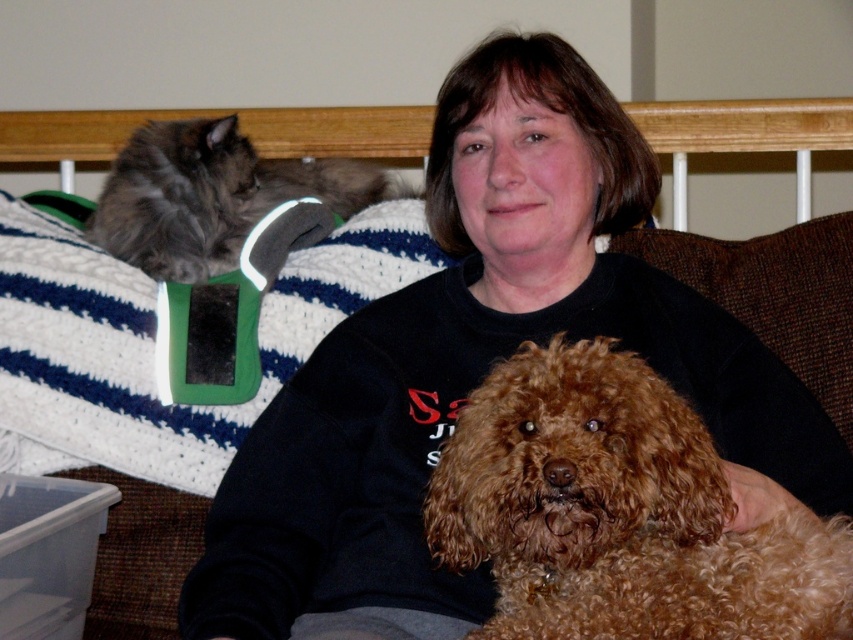
You are a photographer trying to capture a clear shot of the brown curly fur dog at center and the gray fluffy cat at upper left. Since the dog is closer to the camera, will its image appear larger in the photo than the cat?

The brown curly fur dog at center has a lesser width compared to gray fluffy cat at upper left. Even though the dog is closer, its actual width is smaller, so the dog might not appear larger than the cat in the photo depending on the distance difference.

You are a photographer setting up a shot in this scene. You need to position a light source to the left of the gray fluffy cat at upper left and another light source to the right of the brown curly fur dog at center. Will the two light sources be on the same side of the image?

The brown curly fur dog at center is to the right of the gray fluffy cat at upper left. Therefore, placing a light source to the left of the gray fluffy cat at upper left and another to the right of the brown curly fur dog at center would mean the two light sources are on opposite sides of the image.